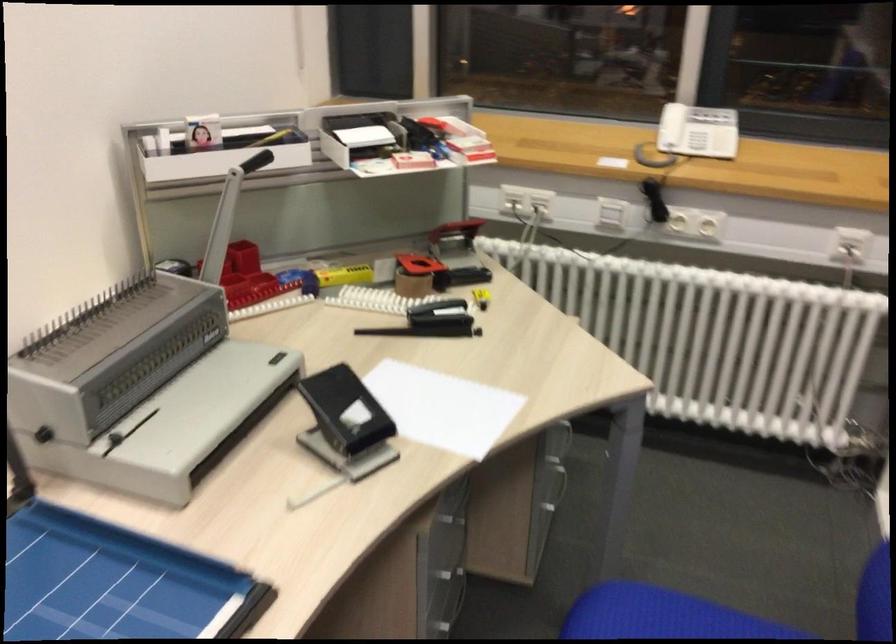
Identify the location of red tape dispenser. The height and width of the screenshot is (644, 896). (454, 236).